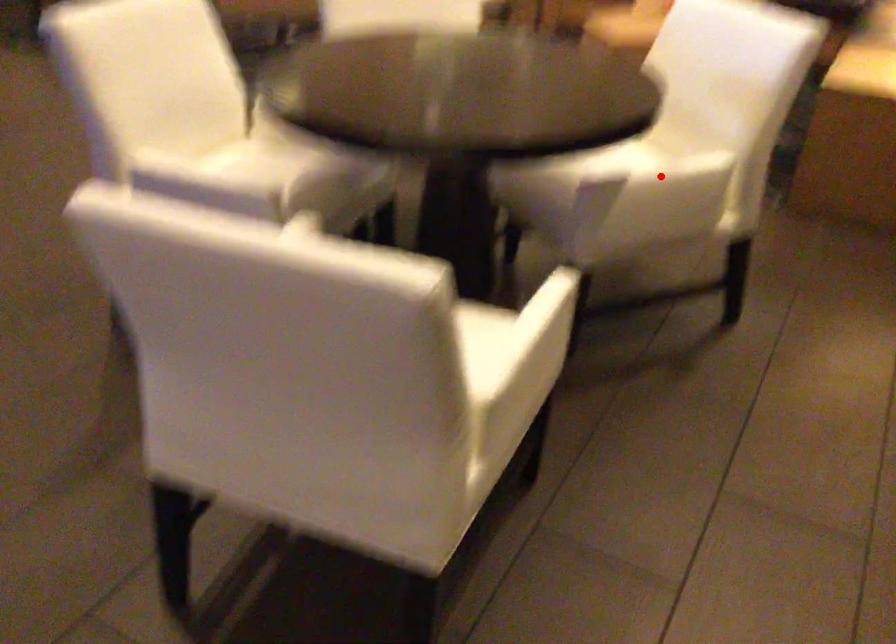
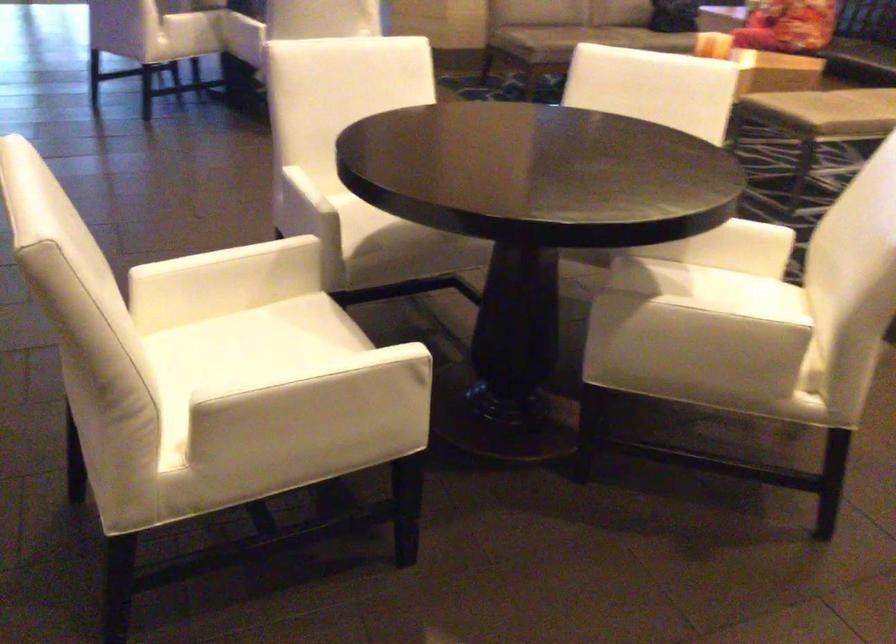
In the second image, find the point that corresponds to the highlighted location in the first image.

(699, 319)